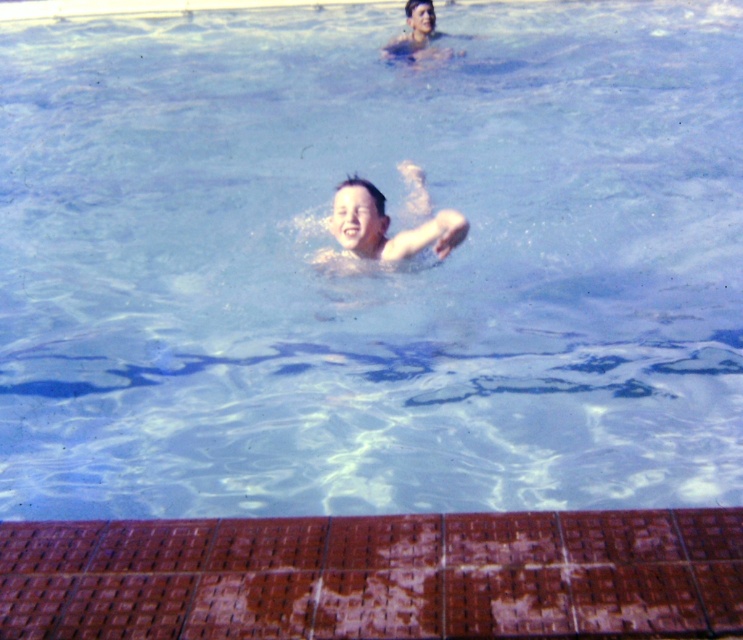
Who is positioned more to the right, smooth skin boy at center or smooth skin man at upper center?

Positioned to the right is smooth skin man at upper center.

Is point (441, 221) farther from viewer compared to point (418, 4)?

No, (441, 221) is in front of (418, 4).

You are a GUI agent. You are given a task and a screenshot of the screen. Output one action in this format:
    pyautogui.click(x=<x>, y=<y>)
    Task: Click on the smooth skin boy at center
    
    Given the screenshot: What is the action you would take?
    pyautogui.click(x=380, y=228)